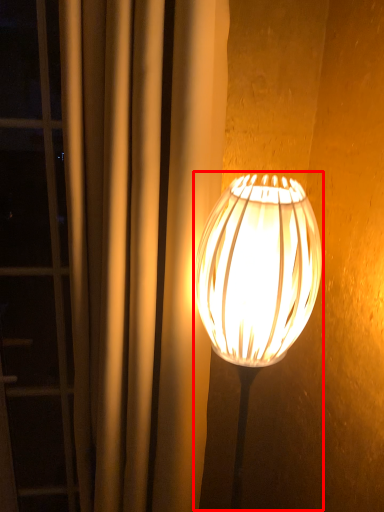
Question: From the image's perspective, what is the correct spatial positioning of lamp (annotated by the red box) in reference to curtain?

Choices:
 (A) below
 (B) above

Answer: (A)